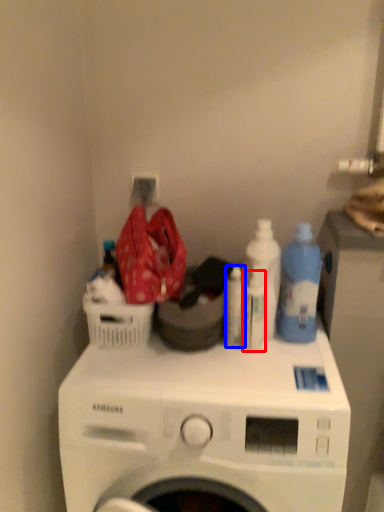
Question: Which of the following is the farthest to the observer, bottle (highlighted by a red box) or cleaning product (highlighted by a blue box)?

Choices:
 (A) bottle
 (B) cleaning product

Answer: (B)